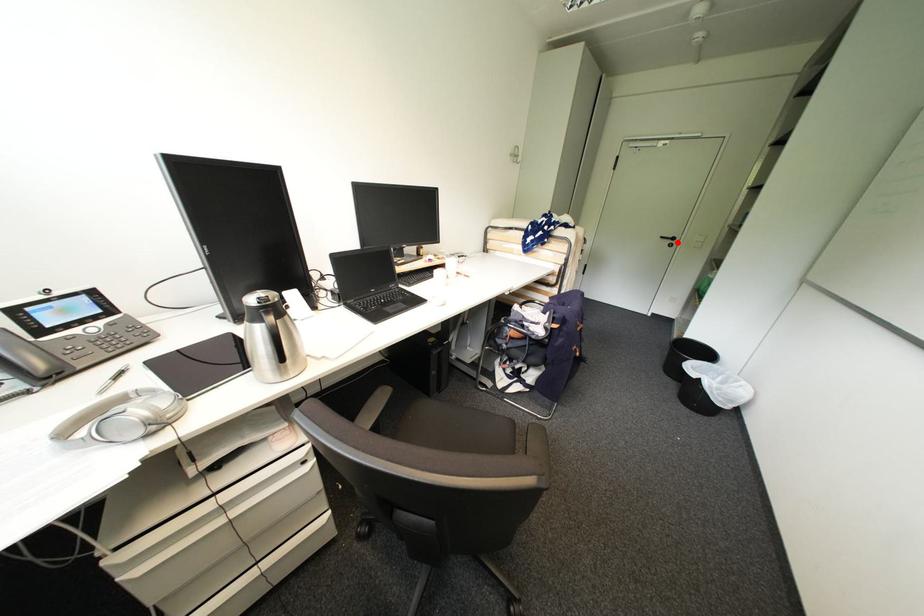
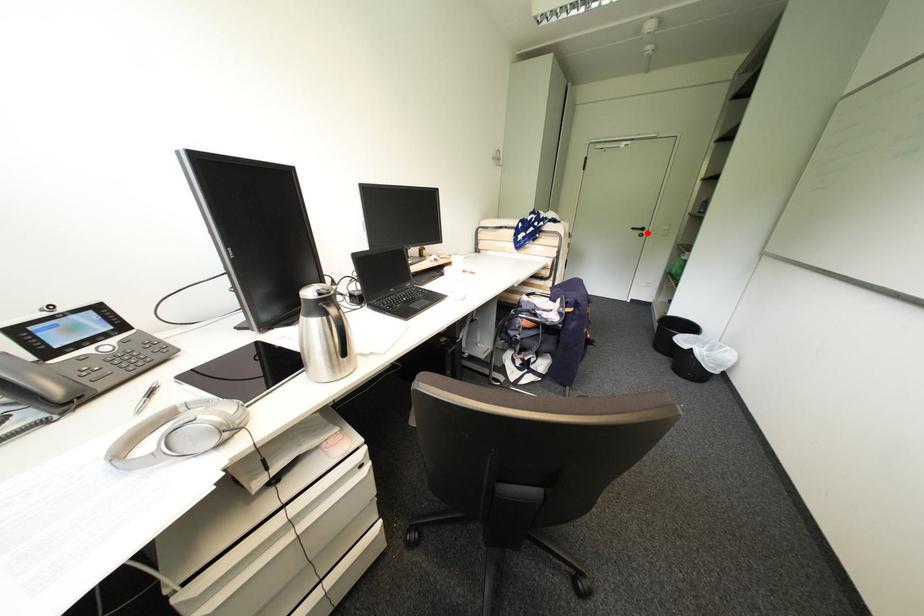
I am providing you with two images of the same scene from different viewpoints. A red point is marked on the first image and another point is marked on the second image. Do the highlighted points in image1 and image2 indicate the same real-world spot?

Yes